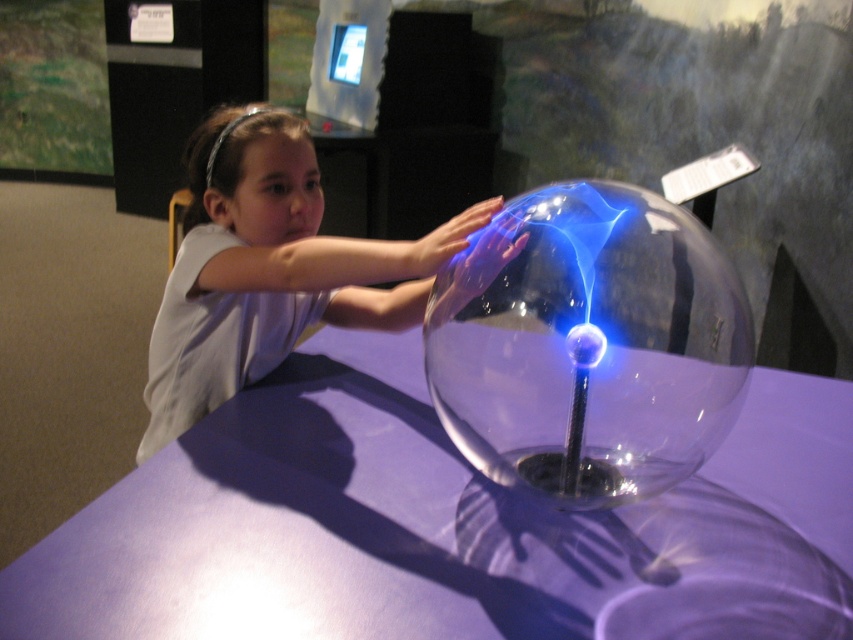
Is purple glass table at center above transparent glass sphere at center?

Actually, purple glass table at center is below transparent glass sphere at center.

Find the location of `purple glass table at center`. purple glass table at center is located at coordinates (442, 525).

You are a GUI agent. You are given a task and a screenshot of the screen. Output one action in this format:
    pyautogui.click(x=<x>, y=<y>)
    Task: Click on the purple glass table at center
    The width and height of the screenshot is (853, 640).
    Given the screenshot: What is the action you would take?
    pyautogui.click(x=442, y=525)

Who is more distant from viewer, (492,262) or (241,330)?

The point (241,330) is more distant.

Between transparent glass sphere at center and white glossy shirt at upper center, which one appears on the left side from the viewer's perspective?

From the viewer's perspective, white glossy shirt at upper center appears more on the left side.

Where is `transparent glass sphere at center`? The width and height of the screenshot is (853, 640). transparent glass sphere at center is located at coordinates tap(589, 344).

Where is `purple glass table at center`? Image resolution: width=853 pixels, height=640 pixels. purple glass table at center is located at coordinates (442, 525).

Does purple glass table at center appear over white glossy shirt at upper center?

Incorrect, purple glass table at center is not positioned above white glossy shirt at upper center.

Find the location of `purple glass table at center`. purple glass table at center is located at coordinates (442, 525).